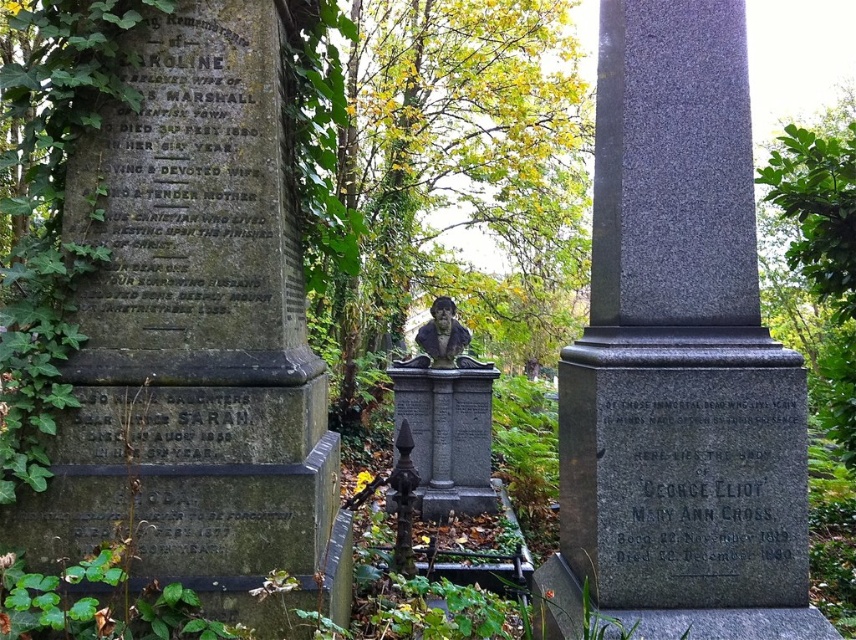
Question: Estimate the real-world distances between objects in this image. Which object is farther from the granite stone monument at left?

Choices:
 (A) granite obelisk at center
 (B) matte stone bust at center

Answer: (B)

Question: Considering the relative positions of granite stone monument at left and matte stone bust at center in the image provided, where is granite stone monument at left located with respect to matte stone bust at center?

Choices:
 (A) left
 (B) right

Answer: (A)

Question: Which object is farther from the camera taking this photo?

Choices:
 (A) granite stone monument at left
 (B) granite obelisk at center
 (C) polished bronze bust at center

Answer: (C)

Question: Which of the following is the farthest from the observer?

Choices:
 (A) (438, 378)
 (B) (714, 499)
 (C) (437, 352)
 (D) (182, 26)

Answer: (C)

Question: Is granite stone monument at left smaller than polished bronze bust at center?

Choices:
 (A) no
 (B) yes

Answer: (A)

Question: In this image, where is granite stone monument at left located relative to granite obelisk at center?

Choices:
 (A) below
 (B) above

Answer: (A)